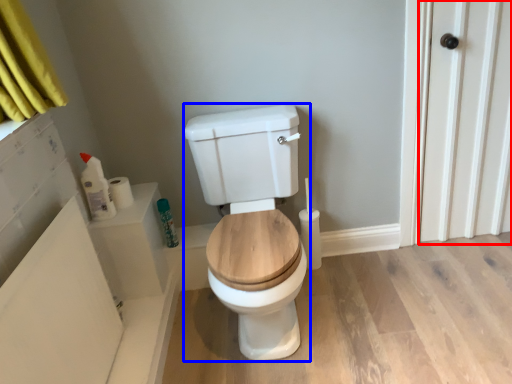
Question: Which point is further to the camera, screen door (highlighted by a red box) or porcelain (highlighted by a blue box)?

Choices:
 (A) screen door
 (B) porcelain

Answer: (A)